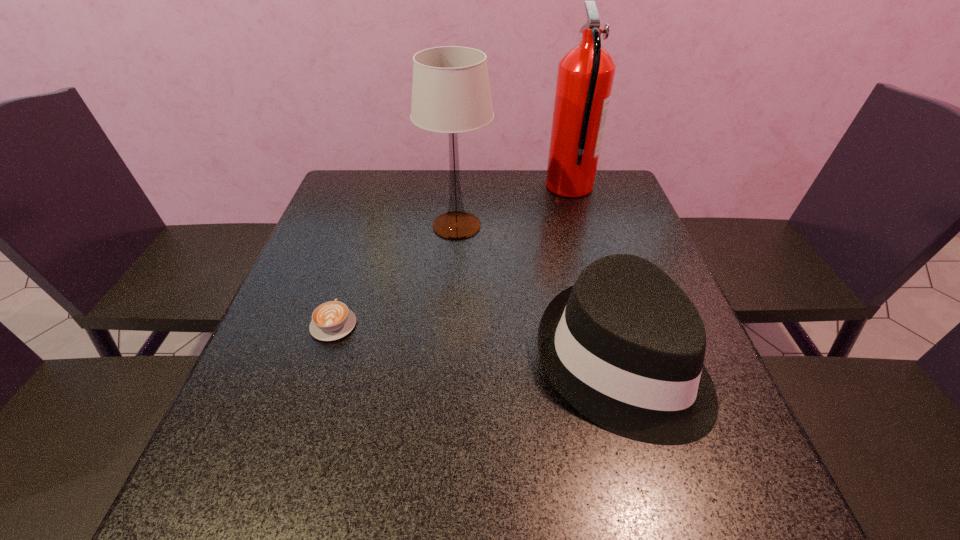
This screenshot has height=540, width=960. I want to click on fire extinguisher, so click(x=585, y=76).

Where is `the third nearest object`? Image resolution: width=960 pixels, height=540 pixels. the third nearest object is located at coordinates (451, 94).

Identify the location of the second object from left to right. The width and height of the screenshot is (960, 540). (451, 94).

Locate an element on the screen. The image size is (960, 540). fedora is located at coordinates point(625,346).

Image resolution: width=960 pixels, height=540 pixels. What are the coordinates of `cappuccino` in the screenshot? It's located at (332, 320).

What are the coordinates of `the leftmost object` in the screenshot? It's located at (332, 320).

Find the location of a particular element. Image resolution: width=960 pixels, height=540 pixels. vacant space located 0.050m at the nozzle of the farthest object is located at coordinates (530, 187).

This screenshot has width=960, height=540. I want to click on free location located 0.390m at the nozzle of the farthest object, so click(420, 187).

What are the coordinates of `free space located 0.370m at the nozzle of the farthest object` in the screenshot? It's located at (425, 187).

The image size is (960, 540). What are the coordinates of `vacant area located 0.050m above the cylindrical shade of the table lamp` in the screenshot? It's located at (510, 226).